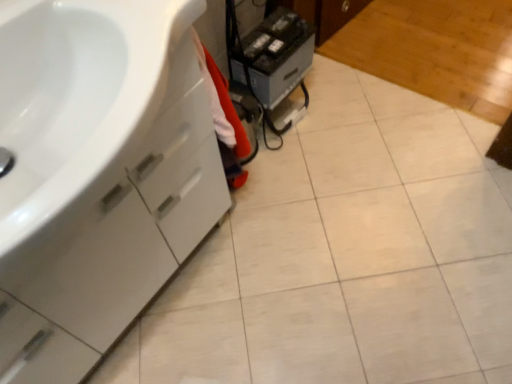
Question: Is white glossy cabinet at left in front of or behind black plastic printer at center in the image?

Choices:
 (A) front
 (B) behind

Answer: (A)

Question: In terms of width, does white glossy cabinet at left look wider or thinner when compared to black plastic printer at center?

Choices:
 (A) thin
 (B) wide

Answer: (B)

Question: From a real-world perspective, is white glossy cabinet at left positioned above or below black plastic printer at center?

Choices:
 (A) below
 (B) above

Answer: (B)

Question: Considering their positions, is black plastic printer at center located in front of or behind white glossy cabinet at left?

Choices:
 (A) behind
 (B) front

Answer: (A)

Question: From a real-world perspective, is black plastic printer at center positioned above or below white glossy cabinet at left?

Choices:
 (A) above
 (B) below

Answer: (B)

Question: Considering the relative positions of black plastic printer at center and white glossy cabinet at left in the image provided, is black plastic printer at center to the left or to the right of white glossy cabinet at left?

Choices:
 (A) left
 (B) right

Answer: (B)

Question: Looking at their shapes, would you say black plastic printer at center is wider or thinner than white glossy cabinet at left?

Choices:
 (A) thin
 (B) wide

Answer: (A)